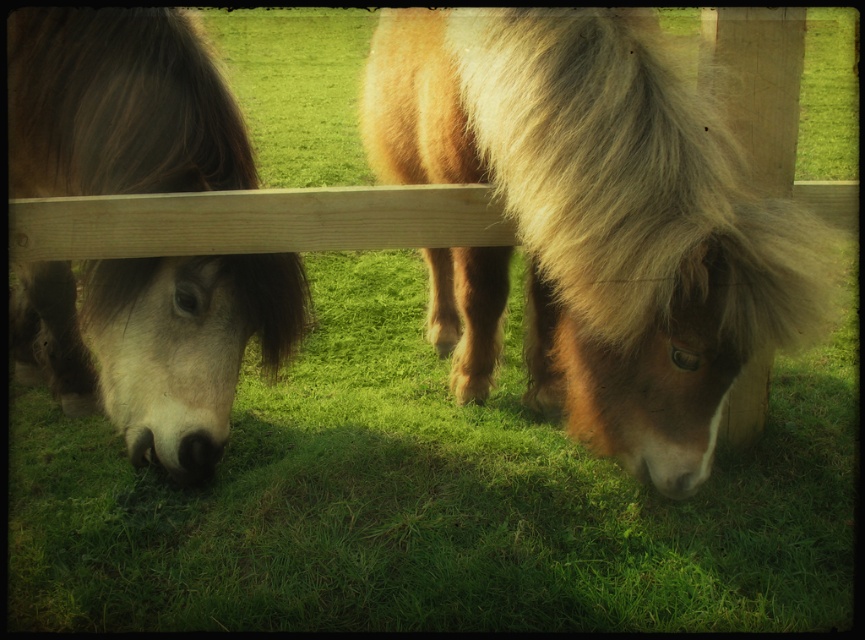
Which is behind, point (513, 58) or point (31, 42)?

The point (31, 42) is more distant.

You are a GUI agent. You are given a task and a screenshot of the screen. Output one action in this format:
    pyautogui.click(x=<x>, y=<y>)
    Task: Click on the brown fuzzy pony at center
    Image resolution: width=865 pixels, height=640 pixels.
    Given the screenshot: What is the action you would take?
    pyautogui.click(x=603, y=216)

Is point (649, 136) in front of point (10, 131)?

Yes, it is.

At what (x,y) coordinates should I click in order to perform the action: click on brown fuzzy pony at center. Please return your answer as a coordinate pair (x, y). Looking at the image, I should click on (603, 216).